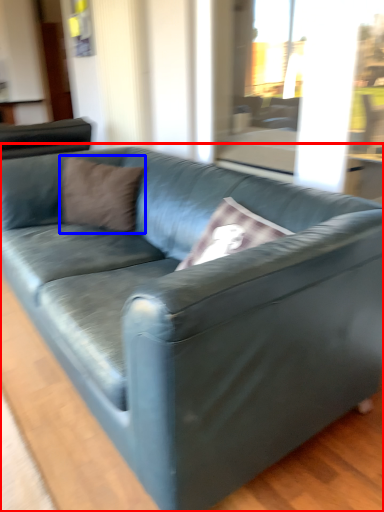
Question: Which object appears farthest to the camera in this image, studio couch (highlighted by a red box) or pillow (highlighted by a blue box)?

Choices:
 (A) studio couch
 (B) pillow

Answer: (B)